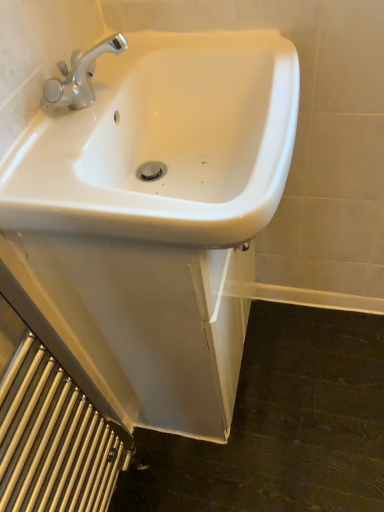
Question: Is white glossy sink at center situated inside silver metallic radiator at lower left or outside?

Choices:
 (A) outside
 (B) inside

Answer: (A)

Question: From a real-world perspective, is white glossy sink at center physically located above or below silver metallic radiator at lower left?

Choices:
 (A) below
 (B) above

Answer: (B)

Question: Is white glossy sink at center taller or shorter than silver metallic radiator at lower left?

Choices:
 (A) short
 (B) tall

Answer: (A)

Question: Relative to white glossy sink at center, is silver metallic radiator at lower left in front or behind?

Choices:
 (A) behind
 (B) front

Answer: (B)

Question: Is point (54, 430) closer or farther from the camera than point (69, 175)?

Choices:
 (A) closer
 (B) farther

Answer: (B)

Question: Considering the positions of silver metallic radiator at lower left and white glossy sink at center in the image, is silver metallic radiator at lower left bigger or smaller than white glossy sink at center?

Choices:
 (A) small
 (B) big

Answer: (A)

Question: Looking at their shapes, would you say silver metallic radiator at lower left is wider or thinner than white glossy sink at center?

Choices:
 (A) thin
 (B) wide

Answer: (A)